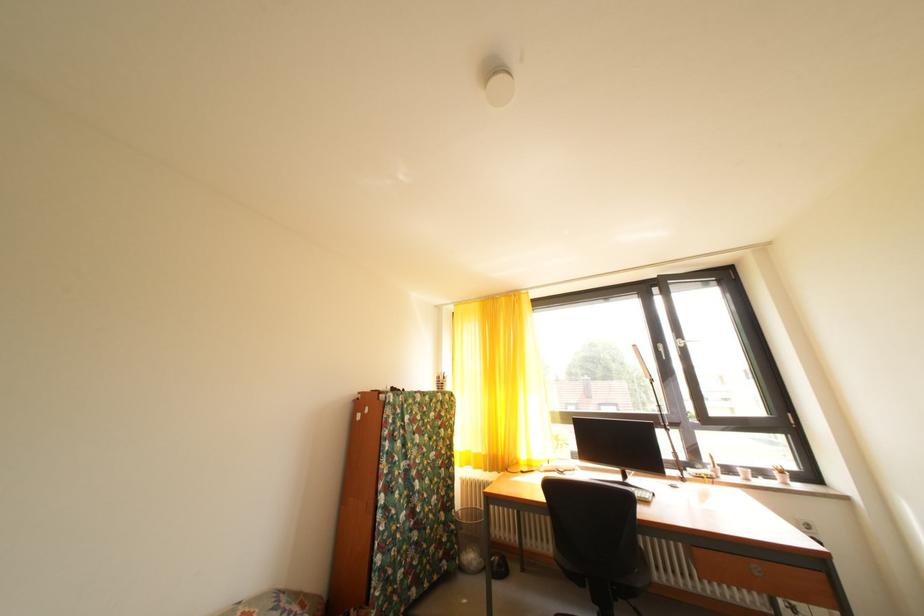
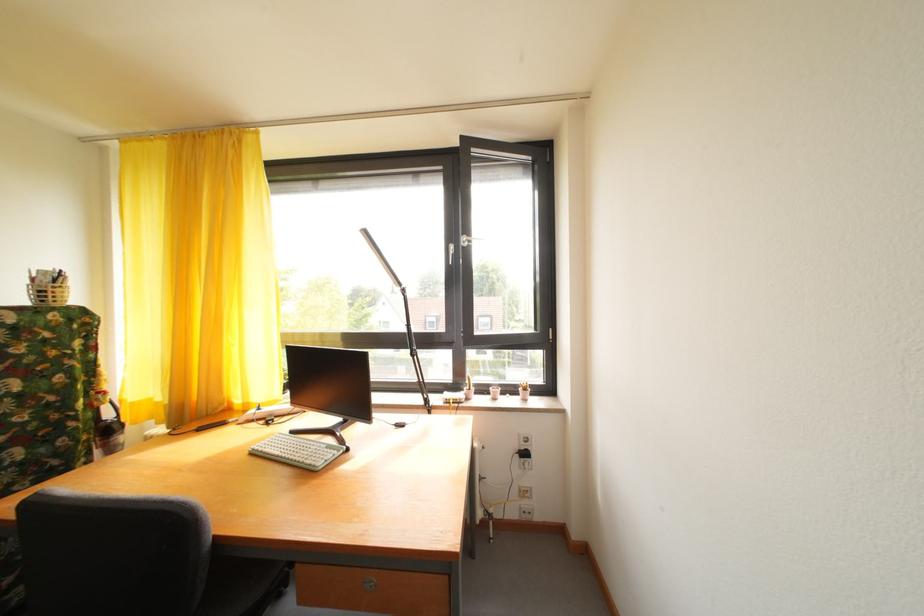
The point at (447, 384) is marked in the first image. Where is the corresponding point in the second image?

(43, 286)